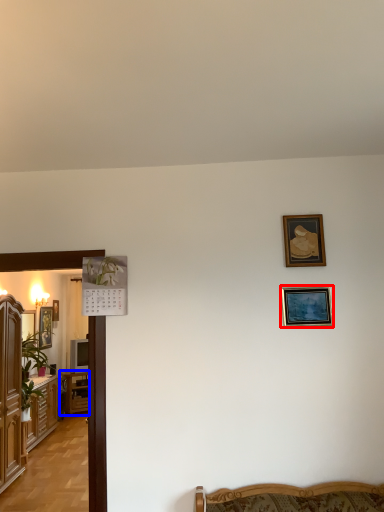
Question: Which of the following is the farthest to the observer, picture frame (highlighted by a red box) or table (highlighted by a blue box)?

Choices:
 (A) picture frame
 (B) table

Answer: (B)